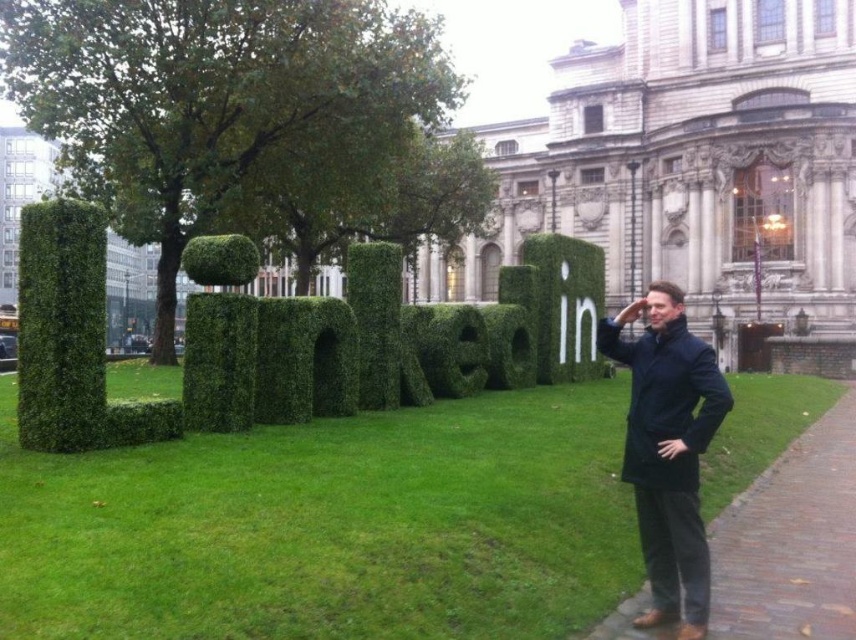
You are standing at the center of the image. You want to walk directly to the green bushy hedge at center. Which direction should you move?

Since you are already at the center of the image, you are already at the position of the green bushy hedge at center located at point [384,340]. Therefore, no movement is needed.

You are standing at point [384,340] in the image. What object is exactly at your current location?

The green bushy hedge at center is exactly at point [384,340].

You are a photographer trying to capture the entire LinkedIn hedge sculpture in your shot. You notice two areas of grass in the foreground. The green grass at center and the white grass letter at center. Which grass area should you adjust your focus to ensure the LinkedIn letters are fully visible?

The green grass at center is positioned on the left side of white grass letter at center. To ensure the LinkedIn letters are fully visible, focus on the white grass letter at center as it is closer to the main sculpture and might be obscuring part of the letters if not adjusted properly.